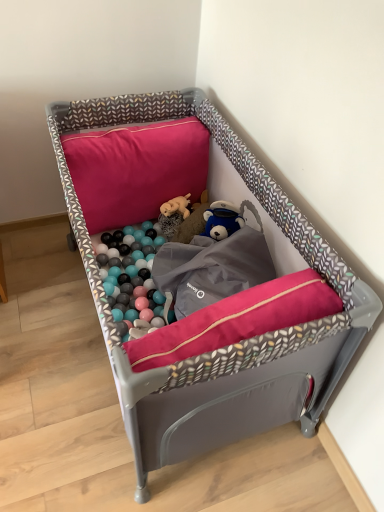
At what (x,y) coordinates should I click in order to perform the action: click on pink fabric pillow at upper center. Please return your answer as a coordinate pair (x, y). The width and height of the screenshot is (384, 512). Looking at the image, I should click on (136, 170).

Image resolution: width=384 pixels, height=512 pixels. I want to click on fluffy beige stuffed animal at center, so click(176, 206).

This screenshot has height=512, width=384. What do you see at coordinates (176, 206) in the screenshot?
I see `fluffy beige stuffed animal at center` at bounding box center [176, 206].

Locate an element on the screen. The image size is (384, 512). matte gray playpen at center is located at coordinates [x=231, y=346].

In the scene shown: Does matte gray playpen at center touch pink fabric pillow at upper center?

No.

Considering the sizes of matte gray playpen at center and pink fabric pillow at upper center in the image, is matte gray playpen at center taller or shorter than pink fabric pillow at upper center?

In the image, matte gray playpen at center appears to be taller than pink fabric pillow at upper center.

From a real-world perspective, which is physically below, matte gray playpen at center or pink fabric pillow at upper center?

matte gray playpen at center is physically lower.

Considering the relative sizes of matte gray playpen at center and pink fabric pillow at upper center in the image provided, is matte gray playpen at center smaller than pink fabric pillow at upper center?

Incorrect, matte gray playpen at center is not smaller in size than pink fabric pillow at upper center.

Is fluffy beige stuffed animal at center not inside pink fabric pillow at upper center?

Absolutely, fluffy beige stuffed animal at center is external to pink fabric pillow at upper center.

Would you consider fluffy beige stuffed animal at center to be distant from pink fabric pillow at upper center?

No, fluffy beige stuffed animal at center is not far from pink fabric pillow at upper center.

Between fluffy beige stuffed animal at center and pink fabric pillow at upper center, which one has less height?

fluffy beige stuffed animal at center.

Looking at this image, is fluffy beige stuffed animal at center facing away from pink fabric pillow at upper center?

That's not correct — fluffy beige stuffed animal at center is not looking away from pink fabric pillow at upper center.

Looking at this image, who is taller, fluffy beige stuffed animal at center or matte gray playpen at center?

Standing taller between the two is matte gray playpen at center.

At what (x,y) coordinates should I click in order to perform the action: click on toy that appears behind the matte gray playpen at center. Please return your answer as a coordinate pair (x, y). The height and width of the screenshot is (512, 384). Looking at the image, I should click on (176, 206).

Can you tell me how much fluffy beige stuffed animal at center and matte gray playpen at center differ in facing direction?

4.42 degrees separate the facing orientations of fluffy beige stuffed animal at center and matte gray playpen at center.

From the picture: Is fluffy beige stuffed animal at center not near matte gray playpen at center?

No, fluffy beige stuffed animal at center is in close proximity to matte gray playpen at center.

From the image's perspective, which one is positioned higher, pink fabric pillow at upper center or fluffy beige stuffed animal at center?

From the image's view, pink fabric pillow at upper center is above.

Identify the location of toy that is on the right side of pink fabric pillow at upper center. pyautogui.click(x=176, y=206).

Is pink fabric pillow at upper center beside fluffy beige stuffed animal at center?

There is a gap between pink fabric pillow at upper center and fluffy beige stuffed animal at center.

Is pink fabric pillow at upper center wider or thinner than matte gray playpen at center?

In the image, pink fabric pillow at upper center appears to be more narrow than matte gray playpen at center.

From a real-world perspective, which is physically below, pink fabric pillow at upper center or matte gray playpen at center?

matte gray playpen at center.

Is point (131, 192) less distant than point (300, 245)?

No.

Is pink fabric pillow at upper center positioned behind matte gray playpen at center?

Yes, pink fabric pillow at upper center is further from the camera.

Is fluffy beige stuffed animal at center at the back of matte gray playpen at center?

Yes, matte gray playpen at center's orientation is away from fluffy beige stuffed animal at center.

Can you tell me how much matte gray playpen at center and fluffy beige stuffed animal at center differ in facing direction?

The angular difference between matte gray playpen at center and fluffy beige stuffed animal at center is 4.42 degrees.

Is matte gray playpen at center closer to camera compared to fluffy beige stuffed animal at center?

Yes, matte gray playpen at center is in front of fluffy beige stuffed animal at center.

Could fluffy beige stuffed animal at center be considered to be inside matte gray playpen at center?

Yes, fluffy beige stuffed animal at center can be found within matte gray playpen at center.

I want to click on infant bed below the pink fabric pillow at upper center (from a real-world perspective), so click(231, 346).

Locate an element on the screen. pillow in front of the fluffy beige stuffed animal at center is located at coordinates (136, 170).

Looking at the image, which one is located further to pink fabric pillow at upper center, fluffy beige stuffed animal at center or matte gray playpen at center?

Among the two, matte gray playpen at center is located further to pink fabric pillow at upper center.

Which object lies further to the anchor point fluffy beige stuffed animal at center, pink fabric pillow at upper center or matte gray playpen at center?

matte gray playpen at center.

Considering their positions, is fluffy beige stuffed animal at center positioned closer to matte gray playpen at center than pink fabric pillow at upper center?

pink fabric pillow at upper center is closer to matte gray playpen at center.

Based on their spatial positions, is matte gray playpen at center or pink fabric pillow at upper center closer to fluffy beige stuffed animal at center?

pink fabric pillow at upper center is positioned closer to the anchor fluffy beige stuffed animal at center.

Which object lies further to the anchor point pink fabric pillow at upper center, matte gray playpen at center or fluffy beige stuffed animal at center?

matte gray playpen at center.

From the image, which object appears to be farther from matte gray playpen at center, pink fabric pillow at upper center or fluffy beige stuffed animal at center?

fluffy beige stuffed animal at center.

You are a GUI agent. You are given a task and a screenshot of the screen. Output one action in this format:
    pyautogui.click(x=<x>, y=<y>)
    Task: Click on the pillow located between matte gray playpen at center and fluffy beige stuffed animal at center in the depth direction
    Image resolution: width=384 pixels, height=512 pixels.
    Given the screenshot: What is the action you would take?
    pyautogui.click(x=136, y=170)